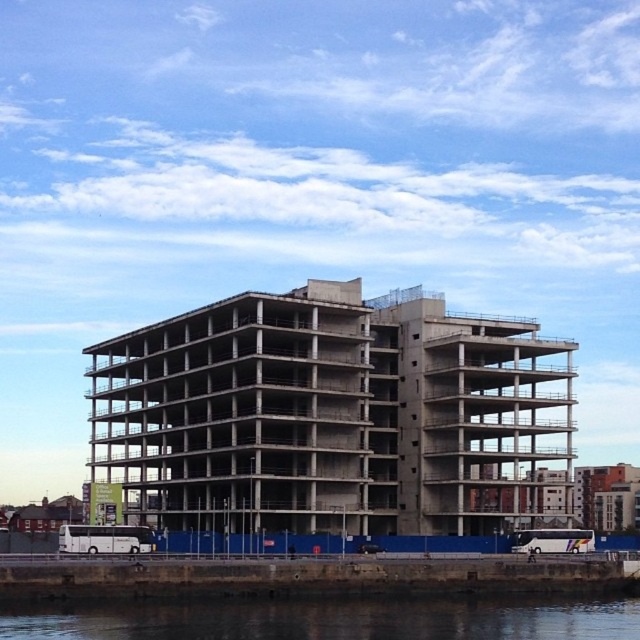
Question: Among these objects, which one is farthest from the camera?

Choices:
 (A) white plastic bus at lower center
 (B) transparent water at lower center

Answer: (A)

Question: Can you confirm if concrete building at center is smaller than white plastic bus at lower center?

Choices:
 (A) yes
 (B) no

Answer: (B)

Question: From the image, what is the correct spatial relationship of transparent water at lower center in relation to white plastic bus at lower center?

Choices:
 (A) right
 (B) left

Answer: (B)

Question: Based on their relative distances, which object is farther from the white plastic bus at lower center?

Choices:
 (A) transparent water at lower center
 (B) concrete building at center

Answer: (A)

Question: Can you confirm if transparent water at lower center is positioned to the right of white plastic bus at lower center?

Choices:
 (A) no
 (B) yes

Answer: (A)

Question: Which object is closer to the camera taking this photo?

Choices:
 (A) concrete building at center
 (B) white plastic bus at lower center

Answer: (B)